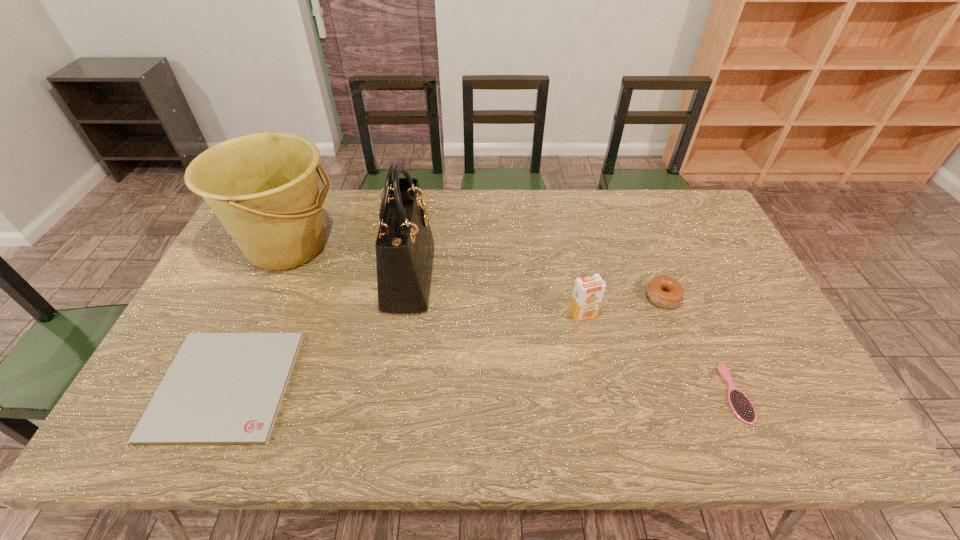
The width and height of the screenshot is (960, 540). Find the location of `vacant space that is in between the orange juice and the rightmost object`. vacant space that is in between the orange juice and the rightmost object is located at coordinates (659, 353).

At what (x,y) coordinates should I click in order to perform the action: click on free space between the clipboard and the second tallest object. Please return your answer as a coordinate pair (x, y). The height and width of the screenshot is (540, 960). Looking at the image, I should click on (256, 315).

Where is `vacant region between the fourth tallest object and the shortest object`? Image resolution: width=960 pixels, height=540 pixels. vacant region between the fourth tallest object and the shortest object is located at coordinates (444, 341).

Find the location of `unoccupied position between the third shortest object and the fourth object from left to right`. unoccupied position between the third shortest object and the fourth object from left to right is located at coordinates (623, 305).

Where is `free point between the fourth tallest object and the tallest object`? The height and width of the screenshot is (540, 960). free point between the fourth tallest object and the tallest object is located at coordinates (536, 287).

Where is `empty space between the handbag and the hairbrush`? empty space between the handbag and the hairbrush is located at coordinates pyautogui.click(x=572, y=335).

Identify the location of free space that is in between the bucket and the fifth tallest object. (512, 319).

Locate an element on the screen. free space between the shortest object and the second shortest object is located at coordinates (480, 389).

Where is `vacant area that lies between the bagel and the clipboard`? This screenshot has height=540, width=960. vacant area that lies between the bagel and the clipboard is located at coordinates (444, 341).

Select which object is the closest to the handbag. Please provide its 2D coordinates. Your answer should be formatted as a tuple, i.e. [(x, y)], where the tuple contains the x and y coordinates of a point satisfying the conditions above.

[(263, 187)]